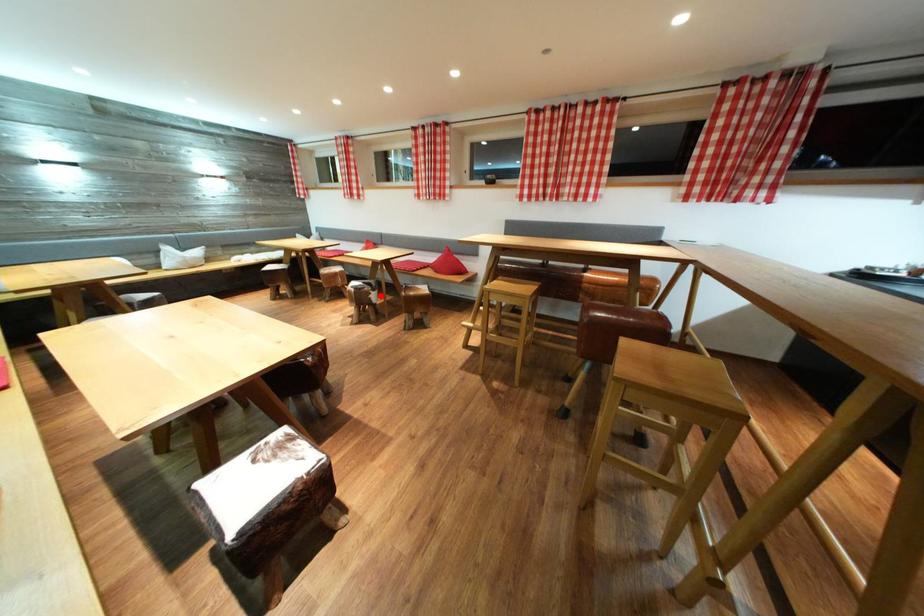
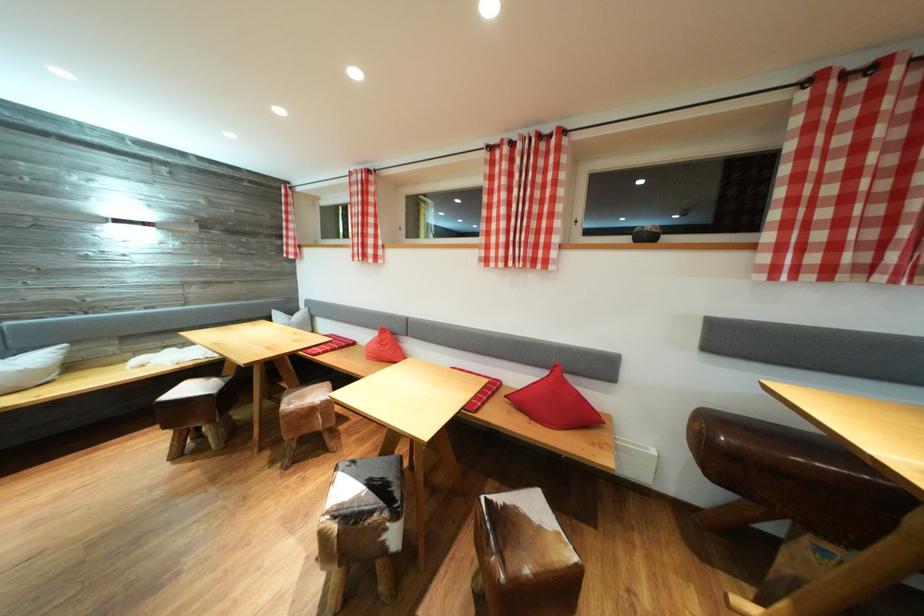
Question: A red point is marked in image1. In image2, is the corresponding 3D point closer to the camera or farther? Reply with the corresponding letter.

Choices:
 (A) The corresponding 3D point is closer.
 (B) The corresponding 3D point is farther.

Answer: (B)